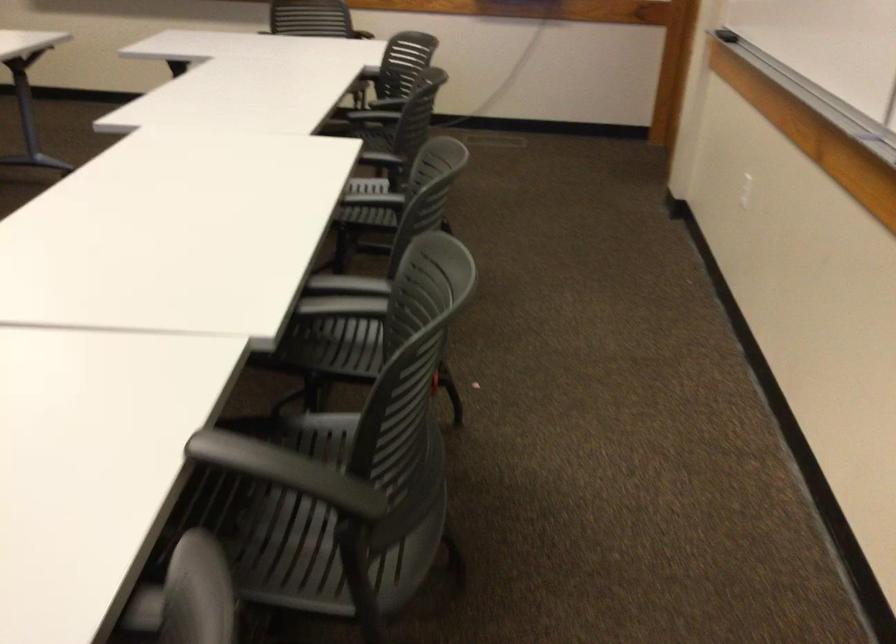
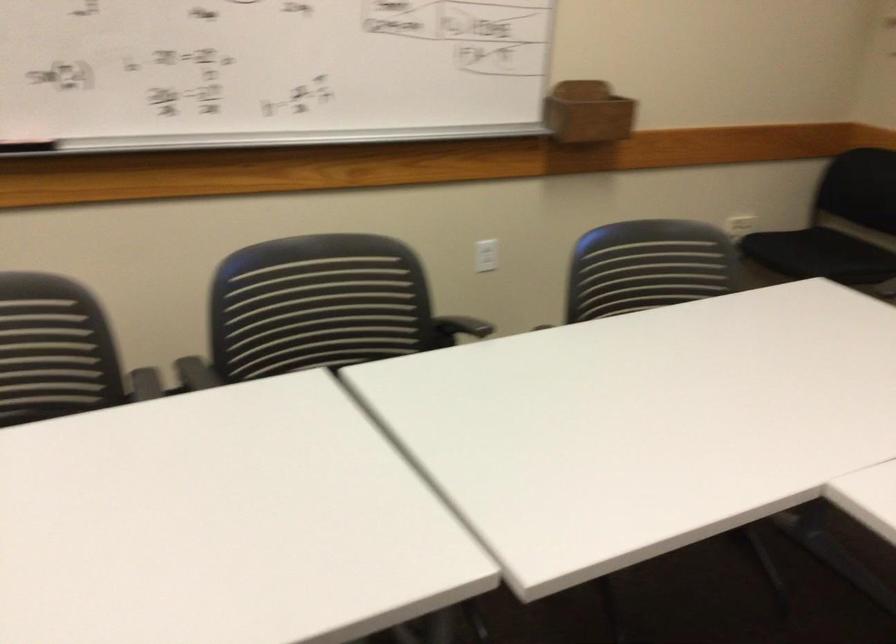
The point at (259, 456) is marked in the first image. Where is the corresponding point in the second image?

(458, 328)